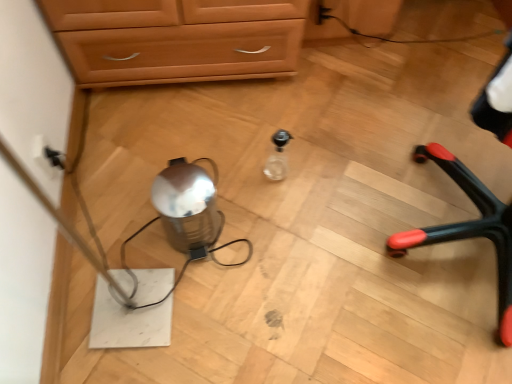
Question: Does transparent glass bottle at center have a lesser width compared to shiny metallic kettle at center?

Choices:
 (A) yes
 (B) no

Answer: (A)

Question: Is transparent glass bottle at center taller than shiny metallic kettle at center?

Choices:
 (A) yes
 (B) no

Answer: (B)

Question: Does transparent glass bottle at center appear on the left side of shiny metallic kettle at center?

Choices:
 (A) no
 (B) yes

Answer: (A)

Question: Is transparent glass bottle at center turned away from shiny metallic kettle at center?

Choices:
 (A) no
 (B) yes

Answer: (A)

Question: Can you confirm if transparent glass bottle at center is shorter than shiny metallic kettle at center?

Choices:
 (A) no
 (B) yes

Answer: (B)

Question: Is transparent glass bottle at center oriented towards shiny metallic kettle at center?

Choices:
 (A) no
 (B) yes

Answer: (A)

Question: Is black plastic chair legs at right directly adjacent to black plastic electric outlet at left?

Choices:
 (A) no
 (B) yes

Answer: (A)

Question: Are black plastic chair legs at right and black plastic electric outlet at left located far from each other?

Choices:
 (A) yes
 (B) no

Answer: (A)

Question: Can you confirm if black plastic chair legs at right is bigger than black plastic electric outlet at left?

Choices:
 (A) no
 (B) yes

Answer: (B)

Question: Is black plastic chair legs at right oriented away from black plastic electric outlet at left?

Choices:
 (A) yes
 (B) no

Answer: (B)

Question: Can we say black plastic chair legs at right lies outside black plastic electric outlet at left?

Choices:
 (A) no
 (B) yes

Answer: (B)

Question: Can you confirm if black plastic chair legs at right is positioned to the right of black plastic electric outlet at left?

Choices:
 (A) no
 (B) yes

Answer: (B)

Question: Considering the relative sizes of shiny metallic kettle at center and black plastic electric outlet at left in the image provided, is shiny metallic kettle at center taller than black plastic electric outlet at left?

Choices:
 (A) yes
 (B) no

Answer: (A)